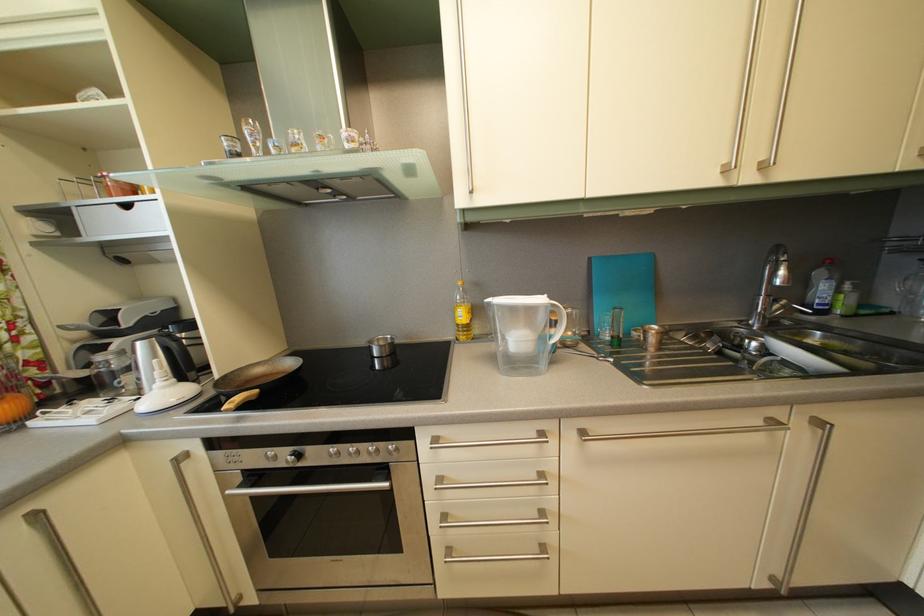
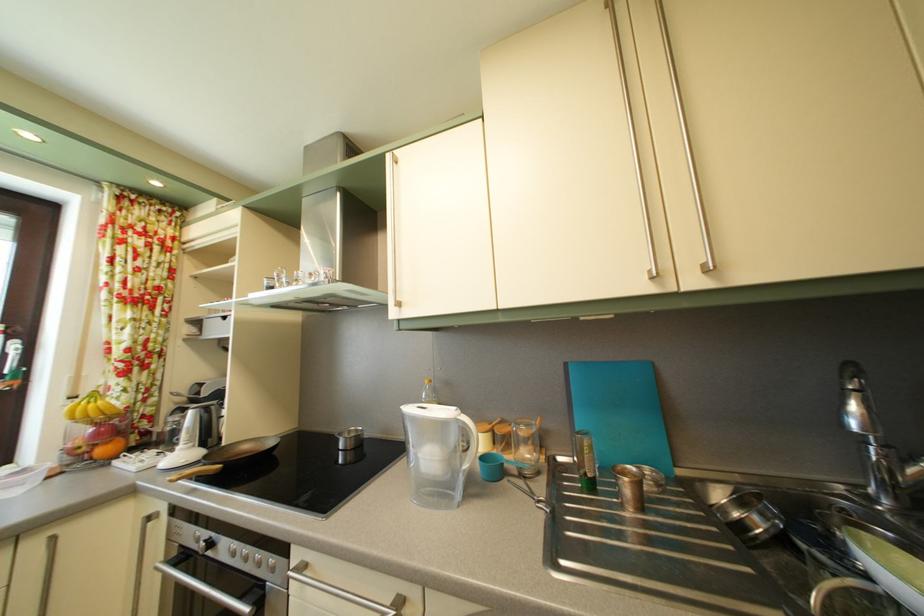
Question: In a continuous first-person perspective shot, in which direction is the camera moving?

Choices:
 (A) Left
 (B) Right
 (C) Forward
 (D) Backward

Answer: (B)